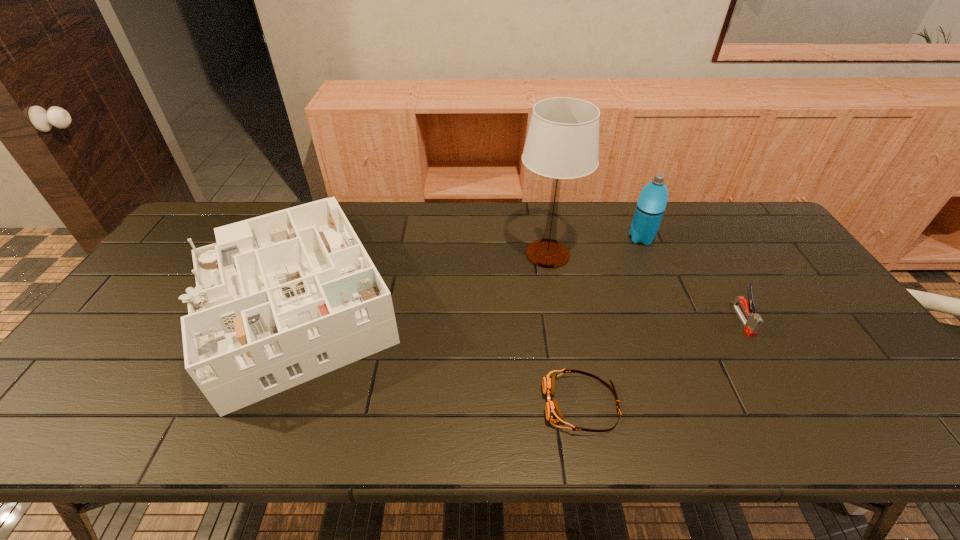
In order to click on vacant space situated on the front of the third shortest object in this screenshot , I will do `click(228, 438)`.

Where is `free spot located 0.130m on the handle side of the stapler`? The image size is (960, 540). free spot located 0.130m on the handle side of the stapler is located at coordinates (777, 380).

Where is `free location located with the lenses facing forward on the shortest object`? The width and height of the screenshot is (960, 540). free location located with the lenses facing forward on the shortest object is located at coordinates (374, 404).

This screenshot has height=540, width=960. What are the coordinates of `vacant space located with the lenses facing forward on the shortest object` in the screenshot? It's located at (401, 404).

What are the coordinates of `free space located with the lenses facing forward on the shortest object` in the screenshot? It's located at (508, 404).

Where is `table lamp that is at the far edge`? table lamp that is at the far edge is located at coordinates (562, 142).

Where is `thermos bottle present at the far edge`? This screenshot has height=540, width=960. thermos bottle present at the far edge is located at coordinates (652, 201).

Locate an element on the screen. The width and height of the screenshot is (960, 540). dollhouse that is at the far edge is located at coordinates (280, 299).

Locate an element on the screen. dollhouse positioned at the near edge is located at coordinates coord(280,299).

The width and height of the screenshot is (960, 540). I want to click on goggles that is at the near edge, so click(x=553, y=413).